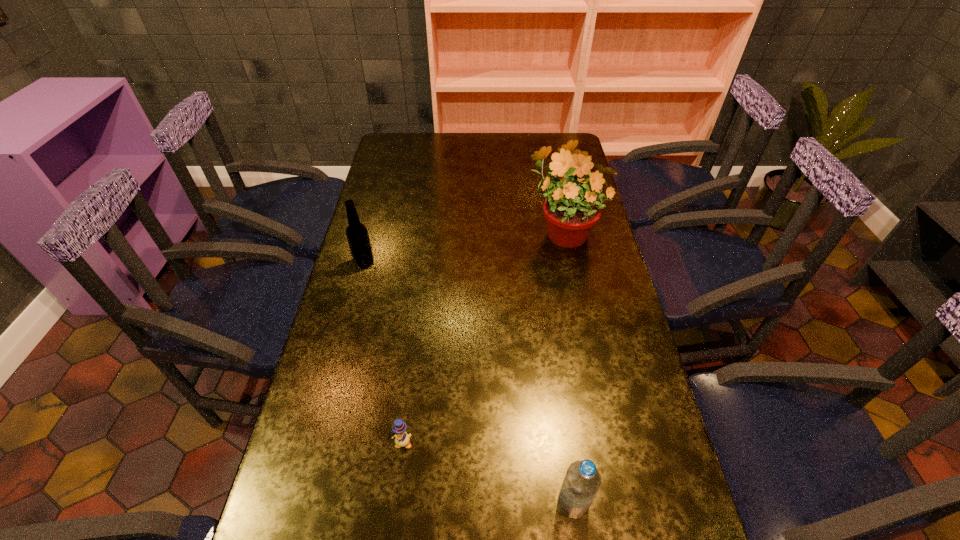
What are the coordinates of `free location located on the face of the second object from left to right, where the monocle is placed` in the screenshot? It's located at (398, 474).

Find the location of `object located in the left edge section of the desktop`. object located in the left edge section of the desktop is located at coordinates (357, 235).

Where is `object at the right edge`? object at the right edge is located at coordinates (571, 209).

Locate an element on the screen. The width and height of the screenshot is (960, 540). vacant position at the far edge of the desktop is located at coordinates (514, 146).

Where is `free space at the left edge of the desktop`? Image resolution: width=960 pixels, height=540 pixels. free space at the left edge of the desktop is located at coordinates (386, 167).

The width and height of the screenshot is (960, 540). In the image, there is a desktop. Find the location of `vacant space at the right edge`. vacant space at the right edge is located at coordinates (582, 267).

I want to click on vacant region at the far left corner of the desktop, so coord(414,145).

This screenshot has height=540, width=960. I want to click on free space that is in between the flowerpot and the third shortest object, so click(x=464, y=247).

The width and height of the screenshot is (960, 540). Identify the location of blank region between the duckling and the beer bottle. (384, 353).

This screenshot has height=540, width=960. What are the coordinates of `empty location between the shortest object and the third nearest object` in the screenshot? It's located at (384, 353).